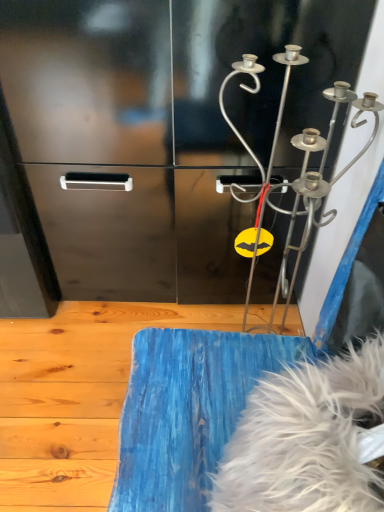
Question: From a real-world perspective, is white fluffy feather at lower right on top of blue painted wood at lower center?

Choices:
 (A) yes
 (B) no

Answer: (A)

Question: From the image's perspective, is white fluffy feather at lower right under blue painted wood at lower center?

Choices:
 (A) no
 (B) yes

Answer: (A)

Question: Does white fluffy feather at lower right come behind blue painted wood at lower center?

Choices:
 (A) yes
 (B) no

Answer: (B)

Question: Is white fluffy feather at lower right not near blue painted wood at lower center?

Choices:
 (A) no
 (B) yes

Answer: (A)

Question: Is white fluffy feather at lower right to the left of blue painted wood at lower center from the viewer's perspective?

Choices:
 (A) yes
 (B) no

Answer: (B)

Question: Is white fluffy feather at lower right shorter than blue painted wood at lower center?

Choices:
 (A) no
 (B) yes

Answer: (A)

Question: Is silver metallic wind chime at upper right shorter than white fluffy feather at lower right?

Choices:
 (A) no
 (B) yes

Answer: (A)

Question: From a real-world perspective, is silver metallic wind chime at upper right under white fluffy feather at lower right?

Choices:
 (A) no
 (B) yes

Answer: (A)

Question: From a real-world perspective, is silver metallic wind chime at upper right on white fluffy feather at lower right?

Choices:
 (A) yes
 (B) no

Answer: (A)

Question: Does silver metallic wind chime at upper right have a lesser width compared to white fluffy feather at lower right?

Choices:
 (A) no
 (B) yes

Answer: (A)

Question: Is silver metallic wind chime at upper right to the right of white fluffy feather at lower right from the viewer's perspective?

Choices:
 (A) no
 (B) yes

Answer: (B)

Question: Is silver metallic wind chime at upper right completely or partially outside of white fluffy feather at lower right?

Choices:
 (A) no
 (B) yes

Answer: (B)

Question: Can you confirm if blue painted wood at lower center is thinner than silver metallic wind chime at upper right?

Choices:
 (A) yes
 (B) no

Answer: (B)